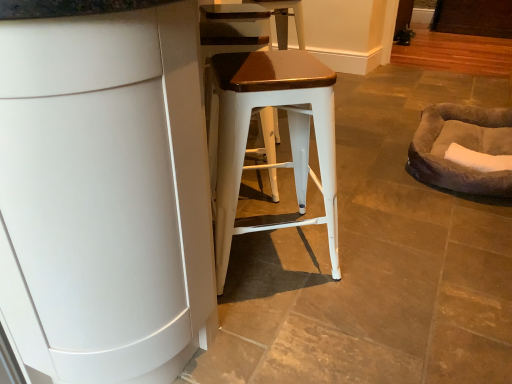
Question: Is white matte cabinet at center wider than brown fuzzy bean bag at right?

Choices:
 (A) no
 (B) yes

Answer: (B)

Question: Is white matte cabinet at center to the right of brown fuzzy bean bag at right from the viewer's perspective?

Choices:
 (A) yes
 (B) no

Answer: (B)

Question: From a real-world perspective, is white matte cabinet at center beneath brown fuzzy bean bag at right?

Choices:
 (A) no
 (B) yes

Answer: (A)

Question: Is white matte cabinet at center oriented away from brown fuzzy bean bag at right?

Choices:
 (A) no
 (B) yes

Answer: (A)

Question: From a real-world perspective, is white matte cabinet at center positioned over brown fuzzy bean bag at right based on gravity?

Choices:
 (A) yes
 (B) no

Answer: (A)

Question: From the image's perspective, relative to matte white stool at center, is white matte cabinet at center above or below?

Choices:
 (A) below
 (B) above

Answer: (B)

Question: From a real-world perspective, is white matte cabinet at center physically located above or below matte white stool at center?

Choices:
 (A) above
 (B) below

Answer: (A)

Question: Is white matte cabinet at center spatially inside matte white stool at center, or outside of it?

Choices:
 (A) outside
 (B) inside

Answer: (A)

Question: Considering the positions of white matte cabinet at center and matte white stool at center in the image, is white matte cabinet at center bigger or smaller than matte white stool at center?

Choices:
 (A) small
 (B) big

Answer: (B)

Question: Considering the positions of matte white stool at center and brown fuzzy bean bag at right in the image, is matte white stool at center wider or thinner than brown fuzzy bean bag at right?

Choices:
 (A) thin
 (B) wide

Answer: (A)

Question: Relative to brown fuzzy bean bag at right, is matte white stool at center in front or behind?

Choices:
 (A) behind
 (B) front

Answer: (B)

Question: From the image's perspective, is matte white stool at center positioned above or below brown fuzzy bean bag at right?

Choices:
 (A) below
 (B) above

Answer: (A)

Question: In terms of size, does matte white stool at center appear bigger or smaller than brown fuzzy bean bag at right?

Choices:
 (A) big
 (B) small

Answer: (A)

Question: In the image, is white matte cabinet at center positioned in front of or behind brown fuzzy bean bag at right?

Choices:
 (A) behind
 (B) front

Answer: (B)

Question: In terms of height, does white matte cabinet at center look taller or shorter compared to brown fuzzy bean bag at right?

Choices:
 (A) tall
 (B) short

Answer: (A)